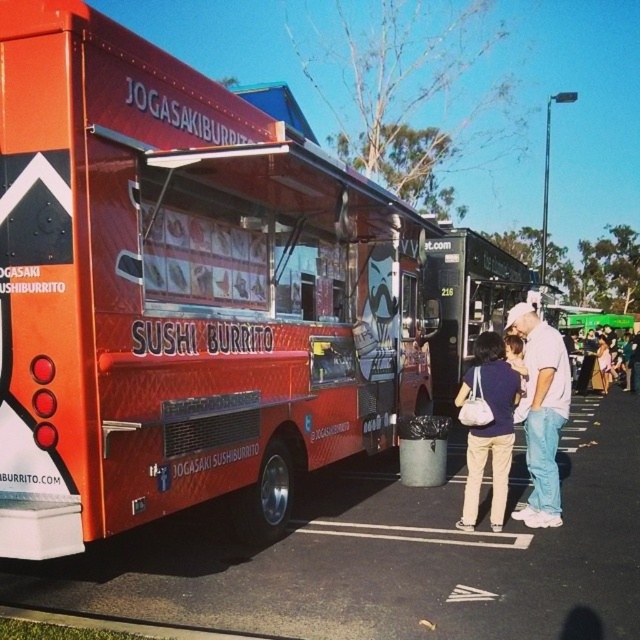
You are a food truck operator who wants to park your truck in the smooth asphalt parking lot at center. You notice a person wearing a matte blue shirt at center is standing in the parking lot. Can you safely park your truck there without hitting the person?

The smooth asphalt parking lot at center might be wider than matte blue shirt at center, so there might be enough space to park without hitting the person, but it is uncertain. Check the exact dimensions before deciding.

You are a customer waiting in line at the food truck event. You notice the smooth asphalt parking lot at center and the matte blue shirt at center. Which object is located below the other?

The smooth asphalt parking lot at center is positioned under matte blue shirt at center, so the smooth asphalt parking lot at center is below the matte blue shirt at center.